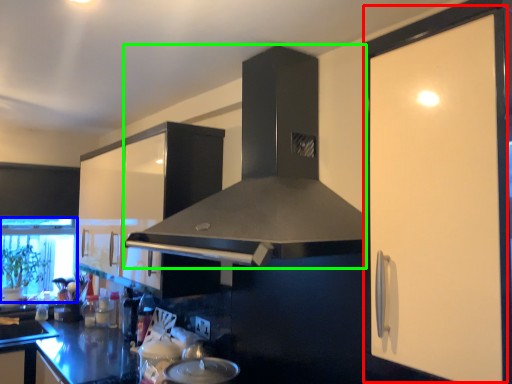
Question: Which object is positioned closest to screen door (highlighted by a red box)? Select from window screen (highlighted by a blue box) and home appliance (highlighted by a green box).

Choices:
 (A) window screen
 (B) home appliance

Answer: (B)